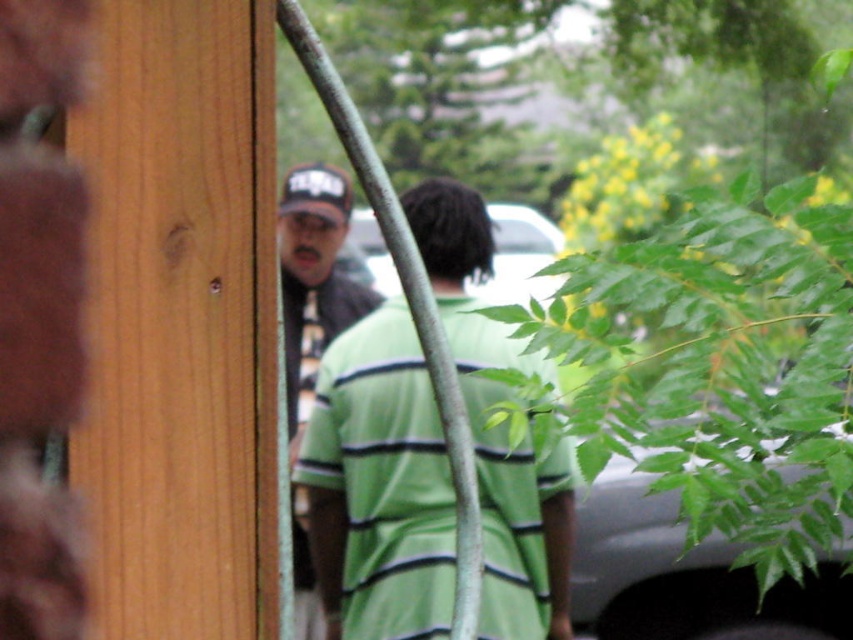
You are standing inside a building and looking through a partially obstructed window. There is a wooden frame on the left side of the window. You see a person wearing a green striped shirt at center. Based on the coordinates provided, is the green striped shirt closer to the top or bottom of the window?

The green striped shirt at center is located at coordinates point [379,484]. Since the y coordinate is 0.445, which is closer to 0.5 than 0, the shirt is closer to the bottom of the window.